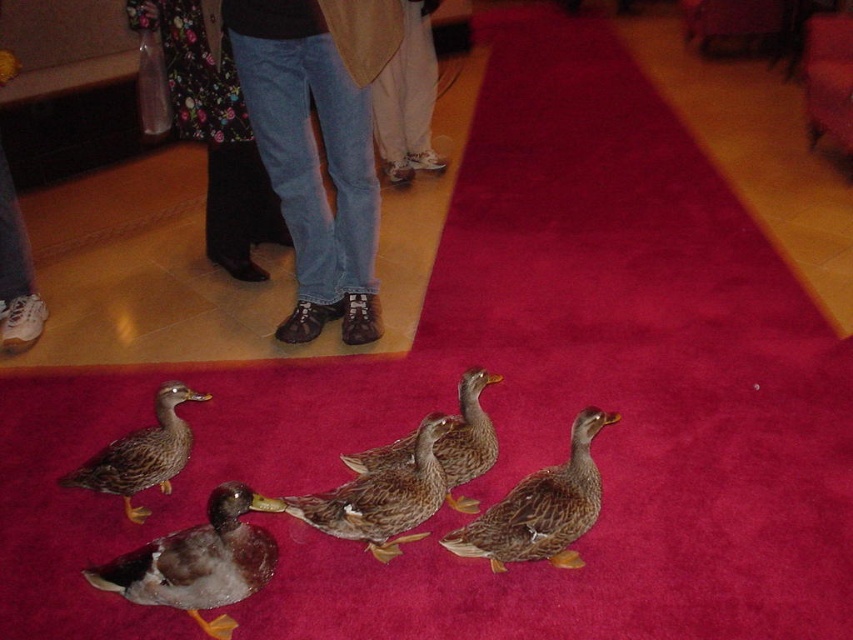
Question: Which of the following is the closest to the observer?

Choices:
 (A) brown matte duck at center
 (B) floral fabric dress at upper left
 (C) brown feathered duck at center
 (D) brown speckled duck at center

Answer: (D)

Question: Does blue jeans at center have a larger size compared to brown feathered duck at center?

Choices:
 (A) no
 (B) yes

Answer: (B)

Question: Estimate the real-world distances between objects in this image. Which object is farther from the brown speckled duck at lower left?

Choices:
 (A) brown feathered duck at center
 (B) floral fabric dress at upper left
 (C) white cotton pants at center

Answer: (C)

Question: Which point is farther from the camera taking this photo?

Choices:
 (A) (106, 461)
 (B) (567, 464)

Answer: (A)

Question: Is brown feathered duck at lower left below brown speckled duck at center?

Choices:
 (A) yes
 (B) no

Answer: (A)

Question: Can you confirm if brown speckled duck at lower left is positioned below brown feathered duck at center?

Choices:
 (A) no
 (B) yes

Answer: (B)